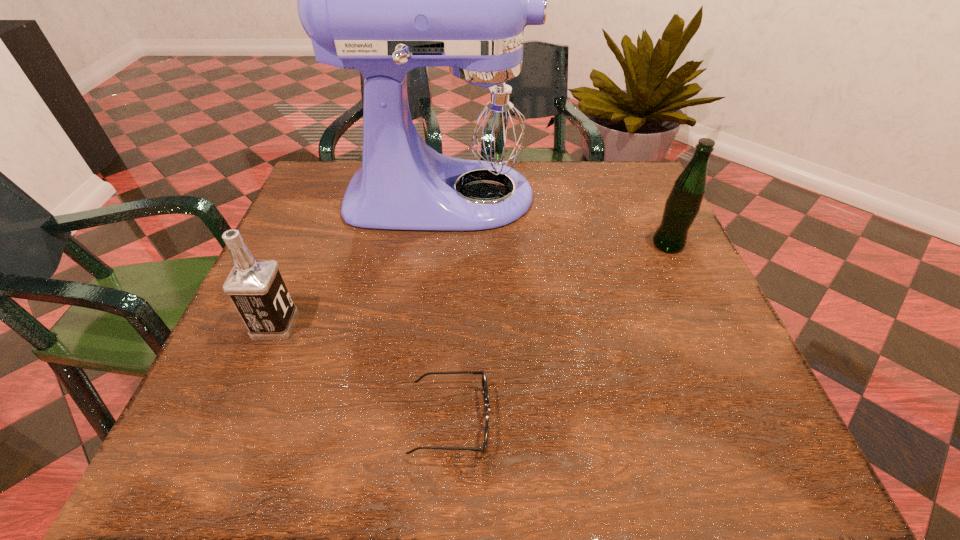
Locate an element on the screen. empty space that is in between the rightmost object and the tallest object is located at coordinates (558, 220).

At what (x,y) coordinates should I click in order to perform the action: click on free space between the shortest object and the tallest object. Please return your answer as a coordinate pair (x, y). Image resolution: width=960 pixels, height=540 pixels. Looking at the image, I should click on (448, 308).

The height and width of the screenshot is (540, 960). I want to click on vacant space that is in between the tallest object and the second nearest object, so click(x=361, y=260).

Find the location of a particular element. The height and width of the screenshot is (540, 960). the third closest object to the tallest object is located at coordinates (484, 381).

I want to click on object that is the second nearest to the vodka, so click(484, 381).

What are the coordinates of `free location that satisfies the following two spatial constraints: 1. at the mixing area of the rightmost object; 2. on the left side of the mixer` in the screenshot? It's located at (443, 244).

The width and height of the screenshot is (960, 540). In order to click on free space that satisfies the following two spatial constraints: 1. on the front side of the rightmost object; 2. on the front label of the leftmost object in this screenshot , I will do `click(705, 325)`.

What are the coordinates of `vacant space that satisfies the following two spatial constraints: 1. at the mixing area of the mixer; 2. on the back side of the beer bottle` in the screenshot? It's located at (443, 244).

I want to click on free space that satisfies the following two spatial constraints: 1. on the back side of the rightmost object; 2. at the mixing area of the mixer, so click(646, 196).

Find the location of a particular element. Image resolution: width=960 pixels, height=540 pixels. vacant space that satisfies the following two spatial constraints: 1. at the mixing area of the rightmost object; 2. on the left side of the mixer is located at coordinates (443, 244).